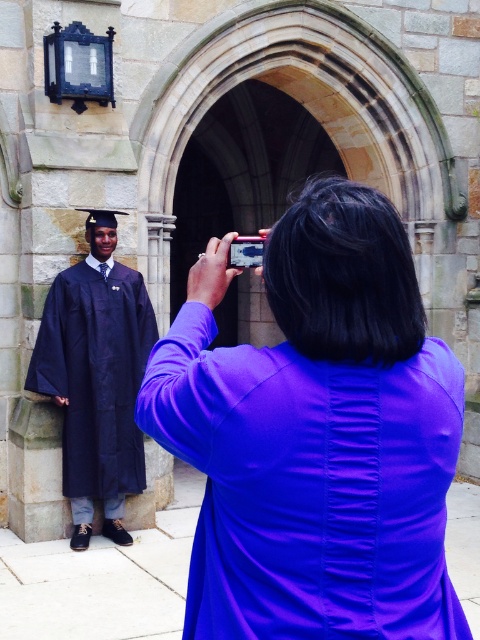
Is purple satin dress at center thinner than matte black gown at left?

In fact, purple satin dress at center might be wider than matte black gown at left.

Is point (345, 550) farther from camera compared to point (110, 403)?

No, (345, 550) is in front of (110, 403).

You are a GUI agent. You are given a task and a screenshot of the screen. Output one action in this format:
    pyautogui.click(x=<x>, y=<y>)
    Task: Click on the purple satin dress at center
    
    Given the screenshot: What is the action you would take?
    pyautogui.click(x=315, y=435)